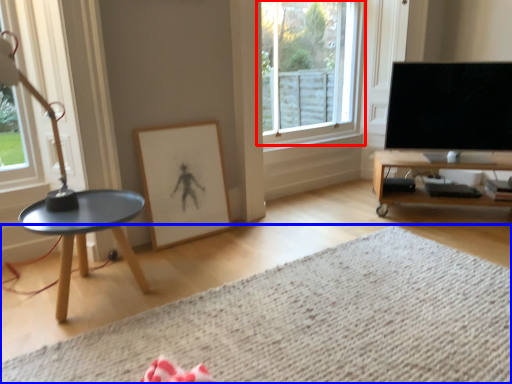
Question: Which object is closer to the camera taking this photo, window (highlighted by a red box) or plain (highlighted by a blue box)?

Choices:
 (A) window
 (B) plain

Answer: (B)